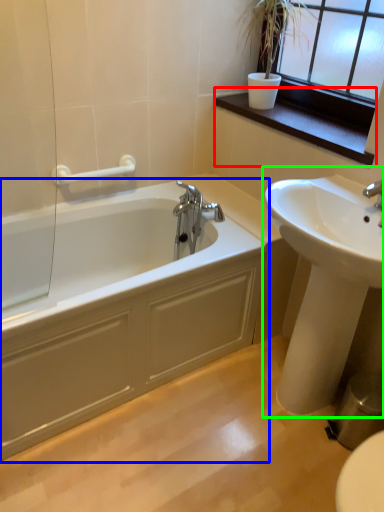
Question: Considering the real-world distances, which object is closest to window sill (highlighted by a red box)? bathtub (highlighted by a blue box) or sink (highlighted by a green box).

Choices:
 (A) bathtub
 (B) sink

Answer: (B)